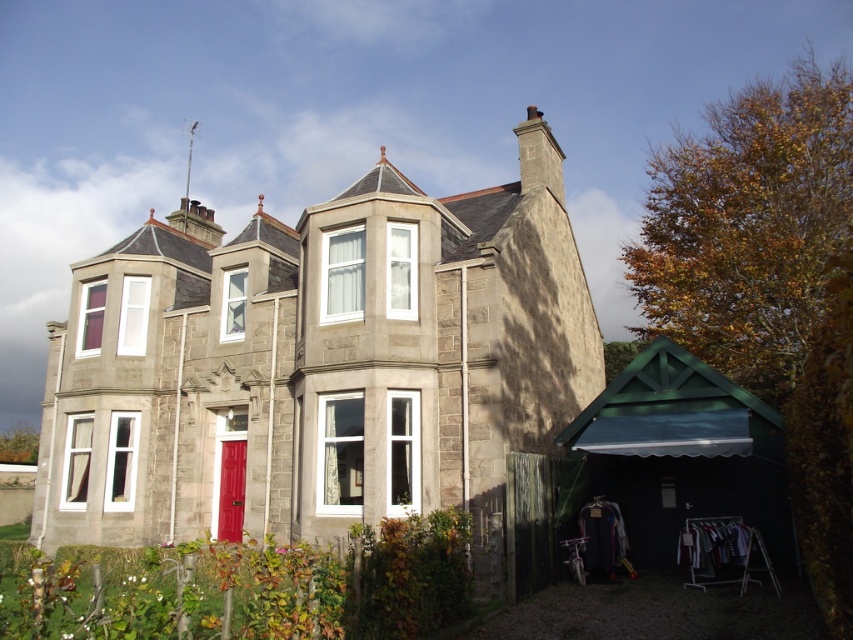
Question: Which point is closer to the camera?

Choices:
 (A) (169, 397)
 (B) (525, 148)

Answer: (A)

Question: Among these points, which one is farthest from the camera?

Choices:
 (A) (376, 225)
 (B) (521, 177)

Answer: (B)

Question: Is smooth stone chimney at center above smooth stone chimney at upper center?

Choices:
 (A) yes
 (B) no

Answer: (B)

Question: Where is smooth stone chimney at center located in relation to smooth stone chimney at upper center in the image?

Choices:
 (A) right
 (B) left

Answer: (B)

Question: Which object is farther from the camera taking this photo?

Choices:
 (A) smooth stone chimney at center
 (B) smooth stone chimney at upper center

Answer: (B)

Question: Is smooth stone chimney at center bigger than smooth stone chimney at upper center?

Choices:
 (A) yes
 (B) no

Answer: (B)